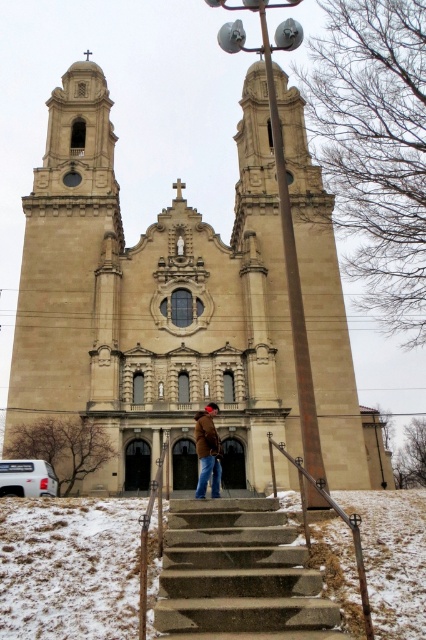
You are standing at the bottom of the church steps and want to approach the entrance. There is a metallic silver railing at lower center and a brown leather coat at center. Which object is closer to your right hand side as you walk towards the entrance?

The metallic silver railing at lower center is positioned on the right side of brown leather coat at center, so as you walk towards the entrance, the metallic silver railing at lower center will be closer to your right hand side.

You are standing at the base of the church steps and want to reach the entrance. Which object is closer to you as you start climbing the concrete stairs at center and the metallic silver railing at lower center?

The concrete stairs at center is closer to you than the metallic silver railing at lower center, so you will first encounter the concrete stairs at center before reaching the entrance.